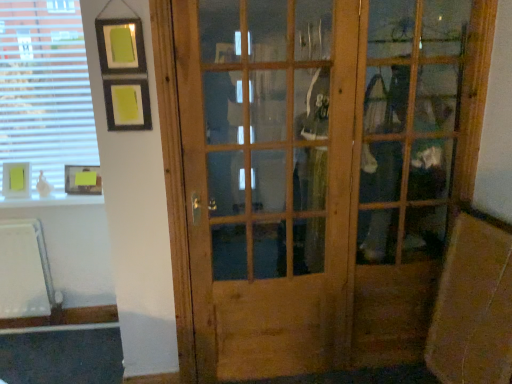
Describe the element at coordinates (82, 179) in the screenshot. I see `yellow paper at lower left, the second picture frame positioned from the left` at that location.

Image resolution: width=512 pixels, height=384 pixels. What do you see at coordinates (45, 88) in the screenshot?
I see `white blinds at upper left` at bounding box center [45, 88].

This screenshot has width=512, height=384. In order to click on yellow paper at lower left, the 1th picture frame in the right-to-left sequence in this screenshot , I will do `click(82, 179)`.

From the image's perspective, which is below, yellow paper at lower left, the second picture frame positioned from the left, or white blinds at upper left?

yellow paper at lower left, the second picture frame positioned from the left, is shown below in the image.

Which is more to the right, yellow paper at lower left, the second picture frame positioned from the left, or white blinds at upper left?

Positioned to the right is yellow paper at lower left, the second picture frame positioned from the left.

Identify the location of picture frame to the right of white blinds at upper left. (82, 179).

Is matte yellow picture frame at upper left, acting as the first picture frame starting from the left, not within white blinds at upper left?

matte yellow picture frame at upper left, acting as the first picture frame starting from the left, lies outside white blinds at upper left's area.

Which of these two, matte yellow picture frame at upper left, acting as the first picture frame starting from the left, or white blinds at upper left, stands shorter?

matte yellow picture frame at upper left, acting as the first picture frame starting from the left.

Are matte yellow picture frame at upper left, placed as the second picture frame when sorted from right to left, and white blinds at upper left making contact?

matte yellow picture frame at upper left, placed as the second picture frame when sorted from right to left, is not next to white blinds at upper left, and they're not touching.

Is yellow paper at lower left, the 1th picture frame in the right-to-left sequence, surrounding matte yellow picture frame at upper left, placed as the second picture frame when sorted from right to left?

No.

Looking at this image, from the image's perspective, is yellow paper at lower left, the second picture frame positioned from the left, above or below matte yellow picture frame at upper left, placed as the second picture frame when sorted from right to left?

yellow paper at lower left, the second picture frame positioned from the left, is above matte yellow picture frame at upper left, placed as the second picture frame when sorted from right to left.

Is point (89, 191) positioned behind point (7, 195)?

Yes, it is.

There is a white blinds at upper left. Where is `the 1st picture frame below it (from the image's perspective)`? the 1st picture frame below it (from the image's perspective) is located at coordinates (82, 179).

Is point (37, 146) positioned in front of point (85, 181)?

That is False.

In the scene shown: Considering the positions of objects white blinds at upper left and yellow paper at lower left, the second picture frame positioned from the left, in the image provided, who is more to the right, white blinds at upper left or yellow paper at lower left, the second picture frame positioned from the left,?

Positioned to the right is yellow paper at lower left, the second picture frame positioned from the left.

From a real-world perspective, is white blinds at upper left positioned under yellow paper at lower left, the 1th picture frame in the right-to-left sequence, based on gravity?

Incorrect, from a real-world perspective, white blinds at upper left is higher than yellow paper at lower left, the 1th picture frame in the right-to-left sequence.

Can you confirm if yellow paper at lower left, the second picture frame positioned from the left, is wider than wooden door at center?

Correct, the width of yellow paper at lower left, the second picture frame positioned from the left, exceeds that of wooden door at center.

Do you think yellow paper at lower left, the 1th picture frame in the right-to-left sequence, is within wooden door at center, or outside of it?

yellow paper at lower left, the 1th picture frame in the right-to-left sequence, is located beyond the bounds of wooden door at center.

Considering the sizes of yellow paper at lower left, the 1th picture frame in the right-to-left sequence, and wooden door at center in the image, is yellow paper at lower left, the 1th picture frame in the right-to-left sequence, taller or shorter than wooden door at center?

In the image, yellow paper at lower left, the 1th picture frame in the right-to-left sequence, appears to be shorter than wooden door at center.

Where is `door on the right side of yellow paper at lower left, the 1th picture frame in the right-to-left sequence`? The image size is (512, 384). door on the right side of yellow paper at lower left, the 1th picture frame in the right-to-left sequence is located at coordinates (319, 176).

From a real-world perspective, is white blinds at upper left physically above wooden door at center?

Yes, from a real-world perspective, white blinds at upper left is above wooden door at center.

In the scene shown: Considering the sizes of objects white blinds at upper left and wooden door at center in the image provided, who is taller, white blinds at upper left or wooden door at center?

wooden door at center is taller.

Who is bigger, white blinds at upper left or wooden door at center?

With larger size is wooden door at center.

How many degrees apart are the facing directions of white blinds at upper left and wooden door at center?

white blinds at upper left and wooden door at center are facing 1.76 degrees away from each other.

Looking at this image, is wooden door at center surrounding white blinds at upper left?

No, white blinds at upper left is located outside of wooden door at center.

Is wooden door at center facing away from white blinds at upper left?

wooden door at center does not have its back to white blinds at upper left.

Based on the photo, does wooden door at center have a greater width compared to white blinds at upper left?

Correct, the width of wooden door at center exceeds that of white blinds at upper left.

Can you confirm if wooden door at center is smaller than white blinds at upper left?

No.

Locate an element on the screen. The height and width of the screenshot is (384, 512). the 2nd picture frame positioned below the white blinds at upper left (from a real-world perspective) is located at coordinates click(x=82, y=179).

At what (x,y) coordinates should I click in order to perform the action: click on window that is above the matte yellow picture frame at upper left, acting as the first picture frame starting from the left (from a real-world perspective). Please return your answer as a coordinate pair (x, y). Looking at the image, I should click on (45, 88).

Looking at the image, which one is located further to yellow paper at lower left, the 1th picture frame in the right-to-left sequence, wooden door at center or white blinds at upper left?

wooden door at center is further to yellow paper at lower left, the 1th picture frame in the right-to-left sequence.

Estimate the real-world distances between objects in this image. Which object is further from wooden door at center, matte yellow picture frame at upper left, placed as the second picture frame when sorted from right to left, or yellow paper at lower left, the second picture frame positioned from the left?

matte yellow picture frame at upper left, placed as the second picture frame when sorted from right to left.

Considering their positions, is yellow paper at lower left, the second picture frame positioned from the left, positioned further to matte yellow picture frame at upper left, placed as the second picture frame when sorted from right to left, than white blinds at upper left?

The object further to matte yellow picture frame at upper left, placed as the second picture frame when sorted from right to left, is white blinds at upper left.

Which object lies further to the anchor point wooden door at center, yellow paper at lower left, the 1th picture frame in the right-to-left sequence, or white blinds at upper left?

yellow paper at lower left, the 1th picture frame in the right-to-left sequence, is positioned further to the anchor wooden door at center.

Estimate the real-world distances between objects in this image. Which object is further from matte yellow picture frame at upper left, acting as the first picture frame starting from the left, white blinds at upper left or wooden door at center?

wooden door at center.

Based on their spatial positions, is wooden door at center or white blinds at upper left further from matte yellow picture frame at upper left, acting as the first picture frame starting from the left?

wooden door at center.

From the image, which object appears to be farther from white blinds at upper left, yellow paper at lower left, the second picture frame positioned from the left, or wooden door at center?

Among the two, wooden door at center is located further to white blinds at upper left.

When comparing their distances from matte yellow picture frame at upper left, acting as the first picture frame starting from the left, does wooden door at center or yellow paper at lower left, the 1th picture frame in the right-to-left sequence, seem further?

wooden door at center is positioned further to the anchor matte yellow picture frame at upper left, acting as the first picture frame starting from the left.

Locate an element on the screen. This screenshot has height=384, width=512. picture frame between white blinds at upper left and matte yellow picture frame at upper left, placed as the second picture frame when sorted from right to left, vertically is located at coordinates [x=82, y=179].

You are a GUI agent. You are given a task and a screenshot of the screen. Output one action in this format:
    pyautogui.click(x=<x>, y=<y>)
    Task: Click on the window located between matte yellow picture frame at upper left, placed as the second picture frame when sorted from right to left, and wooden door at center in the left-right direction
    Image resolution: width=512 pixels, height=384 pixels.
    Given the screenshot: What is the action you would take?
    pyautogui.click(x=45, y=88)

Image resolution: width=512 pixels, height=384 pixels. In order to click on picture frame between white blinds at upper left and wooden door at center from left to right in this screenshot , I will do `click(82, 179)`.

In order to click on picture frame between matte yellow picture frame at upper left, acting as the first picture frame starting from the left, and wooden door at center, in the horizontal direction in this screenshot , I will do `click(82, 179)`.